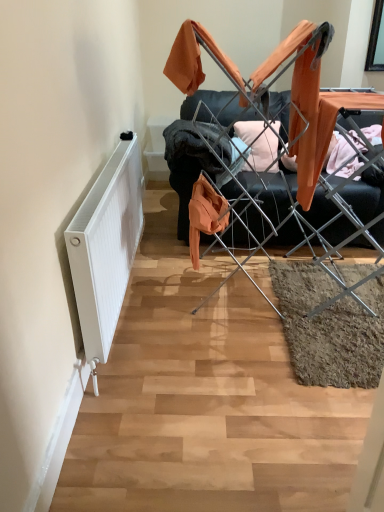
Question: Is metal drying rack at center to the right of white matte radiator at left from the viewer's perspective?

Choices:
 (A) yes
 (B) no

Answer: (A)

Question: Are metal drying rack at center and white matte radiator at left located far from each other?

Choices:
 (A) yes
 (B) no

Answer: (B)

Question: Does metal drying rack at center have a smaller size compared to white matte radiator at left?

Choices:
 (A) no
 (B) yes

Answer: (A)

Question: Does metal drying rack at center turn towards white matte radiator at left?

Choices:
 (A) no
 (B) yes

Answer: (A)

Question: From a real-world perspective, is metal drying rack at center below white matte radiator at left?

Choices:
 (A) yes
 (B) no

Answer: (B)

Question: Considering the positions of point (79, 271) and point (203, 35), is point (79, 271) closer or farther from the camera than point (203, 35)?

Choices:
 (A) closer
 (B) farther

Answer: (A)

Question: Looking at the image, does white matte radiator at left seem bigger or smaller compared to metal drying rack at center?

Choices:
 (A) big
 (B) small

Answer: (B)

Question: Would you say white matte radiator at left is inside or outside metal drying rack at center?

Choices:
 (A) inside
 (B) outside

Answer: (B)

Question: Is white matte radiator at left in front of or behind metal drying rack at center in the image?

Choices:
 (A) behind
 (B) front

Answer: (B)

Question: In terms of height, does white matte radiator at left look taller or shorter compared to orange fabric at center?

Choices:
 (A) short
 (B) tall

Answer: (B)

Question: Is white matte radiator at left wider or thinner than orange fabric at center?

Choices:
 (A) thin
 (B) wide

Answer: (A)

Question: Is point (87, 313) positioned closer to the camera than point (223, 148)?

Choices:
 (A) farther
 (B) closer

Answer: (B)

Question: Is white matte radiator at left in front of or behind orange fabric at center in the image?

Choices:
 (A) front
 (B) behind

Answer: (A)

Question: In the image, is orange fabric at center on the left side or the right side of metal drying rack at center?

Choices:
 (A) left
 (B) right

Answer: (A)

Question: From a real-world perspective, relative to metal drying rack at center, is orange fabric at center vertically above or below?

Choices:
 (A) above
 (B) below

Answer: (B)